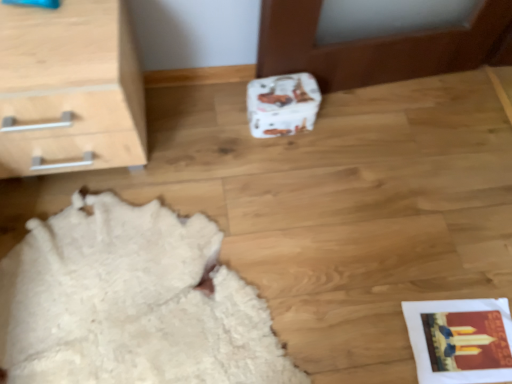
Question: Is light wood/texture chest of drawers at upper left inside white fluffy rug at lower left?

Choices:
 (A) no
 (B) yes

Answer: (A)

Question: Does white fluffy rug at lower left come behind light wood/texture chest of drawers at upper left?

Choices:
 (A) no
 (B) yes

Answer: (B)

Question: Is white fluffy rug at lower left not near light wood/texture chest of drawers at upper left?

Choices:
 (A) yes
 (B) no

Answer: (B)

Question: From a real-world perspective, is white fluffy rug at lower left physically above light wood/texture chest of drawers at upper left?

Choices:
 (A) yes
 (B) no

Answer: (B)

Question: From the image's perspective, is white fluffy rug at lower left beneath light wood/texture chest of drawers at upper left?

Choices:
 (A) no
 (B) yes

Answer: (B)

Question: Can you confirm if white fluffy rug at lower left is bigger than light wood/texture chest of drawers at upper left?

Choices:
 (A) no
 (B) yes

Answer: (A)

Question: Is there a large distance between white paper shoe box at center and light wood/texture chest of drawers at upper left?

Choices:
 (A) no
 (B) yes

Answer: (A)

Question: Does white paper shoe box at center appear on the right side of light wood/texture chest of drawers at upper left?

Choices:
 (A) yes
 (B) no

Answer: (A)

Question: Is white paper shoe box at center with light wood/texture chest of drawers at upper left?

Choices:
 (A) yes
 (B) no

Answer: (B)

Question: Is white paper shoe box at center taller than light wood/texture chest of drawers at upper left?

Choices:
 (A) yes
 (B) no

Answer: (B)

Question: Is white paper shoe box at center positioned in front of light wood/texture chest of drawers at upper left?

Choices:
 (A) no
 (B) yes

Answer: (A)

Question: Is white paper shoe box at center not within light wood/texture chest of drawers at upper left?

Choices:
 (A) no
 (B) yes

Answer: (B)

Question: Considering the relative sizes of light wood/texture chest of drawers at upper left and white paper shoe box at center in the image provided, is light wood/texture chest of drawers at upper left taller than white paper shoe box at center?

Choices:
 (A) no
 (B) yes

Answer: (B)